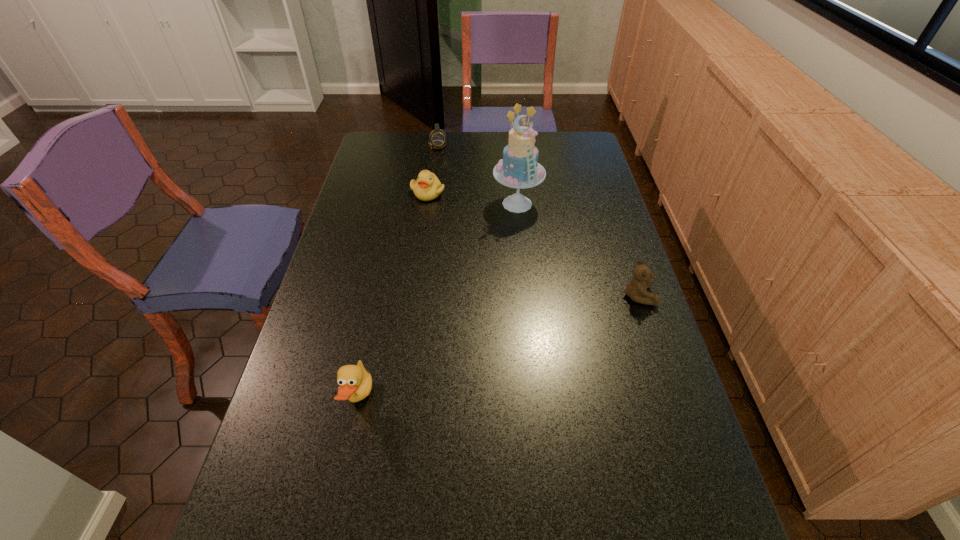
Where is `vacant spot on the desktop that is between the duck and the rightmost object and is positioned with a ladder on the side of the cake`? This screenshot has height=540, width=960. vacant spot on the desktop that is between the duck and the rightmost object and is positioned with a ladder on the side of the cake is located at coordinates (525, 337).

Where is `vacant space on the desktop that is between the duck and the rightmost object and is positioned on the face of the compass`? vacant space on the desktop that is between the duck and the rightmost object and is positioned on the face of the compass is located at coordinates (504, 345).

Locate an element on the screen. Image resolution: width=960 pixels, height=540 pixels. vacant spot on the desktop that is between the duck and the second nearest object and is positioned on the beak of the duckling is located at coordinates (475, 356).